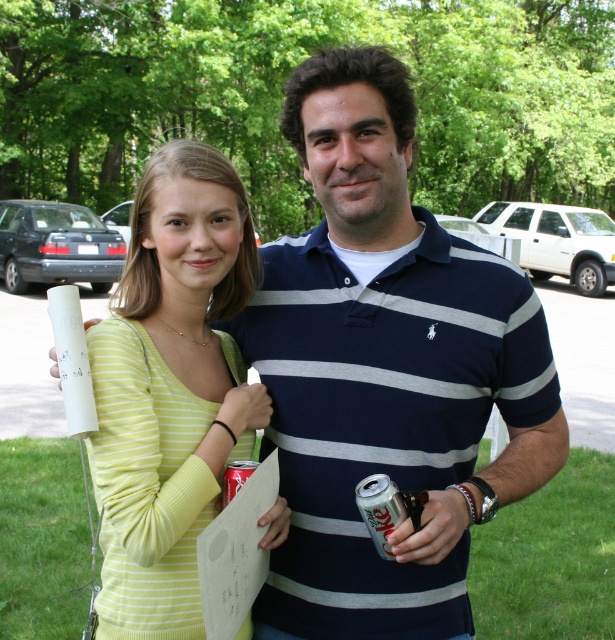
You are a photographer standing 5 feet away from the camera. You want to take a closeup shot of the navy blue striped polo shirt at center. Can you reach it without moving your position?

The navy blue striped polo shirt at center is 4.42 feet away from the camera. Since you are standing 5 feet away from the camera, you are farther away than the shirt. To take a closeup, you need to move closer to the shirt so that you are within 4.42 feet from the camera.

From the picture: You are planning to place both the silver metallic can at lower center and the silver metallic can at center on a small shelf that can only hold one item. Which can should you choose to fit on the shelf?

The silver metallic can at center should be chosen because it is smaller than the silver metallic can at lower center, making it more likely to fit on the small shelf.

You are organizing a picnic and need to pack the navy blue striped polo shirt at center and the silver metallic can at lower center into a bag. Which item should you place first to ensure both fit properly?

The navy blue striped polo shirt at center is bigger than the silver metallic can at lower center, so you should place the navy blue striped polo shirt at center first to make space for the smaller item.